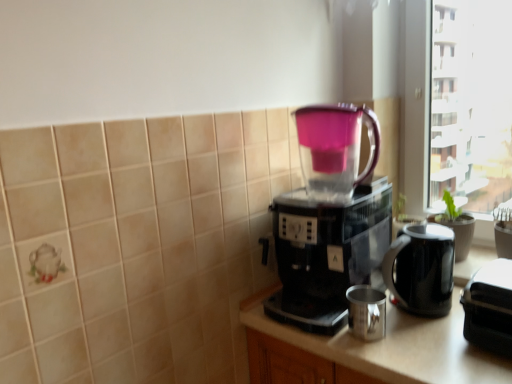
In order to click on vacant area situated to the left side of black plastic toaster at right in this screenshot , I will do `click(430, 351)`.